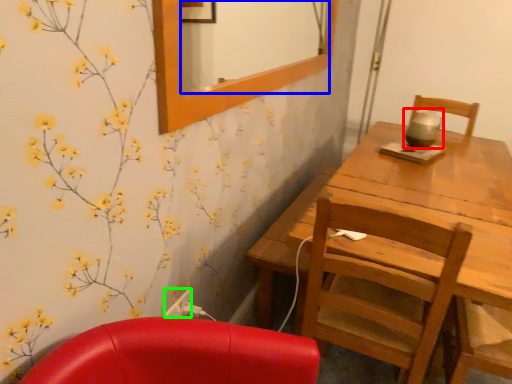
Question: Which object is the farthest from tea pot (highlighted by a red box)? Choose among these: mirror (highlighted by a blue box) or power outlet (highlighted by a green box).

Choices:
 (A) mirror
 (B) power outlet

Answer: (A)